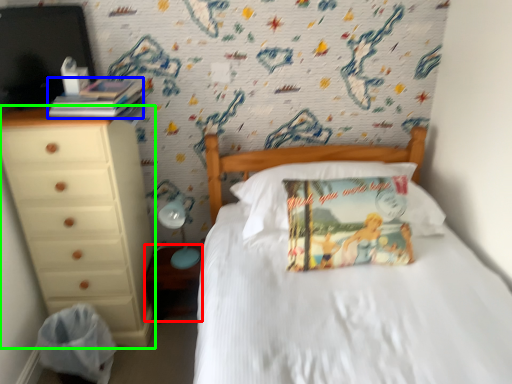
Question: Which object is positioned closest to nightstand (highlighted by a red box)? Select from book (highlighted by a blue box) and chest of drawers (highlighted by a green box).

Choices:
 (A) book
 (B) chest of drawers

Answer: (B)